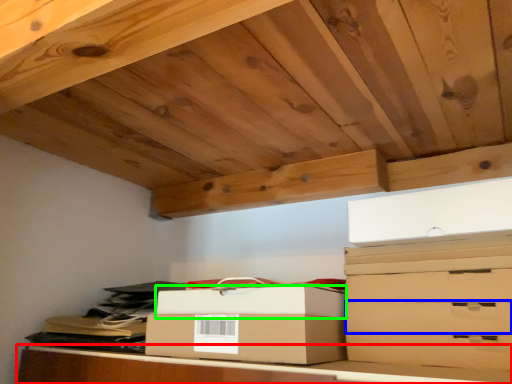
Question: Which object is positioned farthest from furniture (highlighted by a red box)? Select from drawer (highlighted by a blue box) and box (highlighted by a green box).

Choices:
 (A) drawer
 (B) box

Answer: (A)